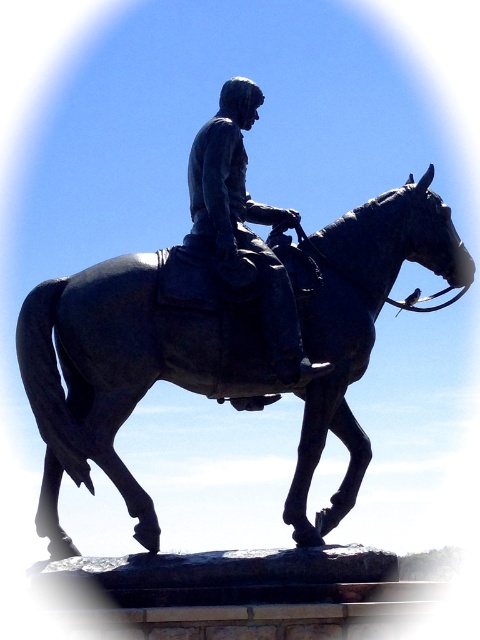
Question: Can you confirm if bronze statue of horse at center is smaller than bronze statue at center?

Choices:
 (A) yes
 (B) no

Answer: (B)

Question: Is bronze statue of horse at center bigger than bronze statue at center?

Choices:
 (A) yes
 (B) no

Answer: (A)

Question: Which point is closer to the camera?

Choices:
 (A) bronze statue of horse at center
 (B) bronze statue at center

Answer: (A)

Question: Does bronze statue of horse at center appear over bronze statue at center?

Choices:
 (A) yes
 (B) no

Answer: (B)